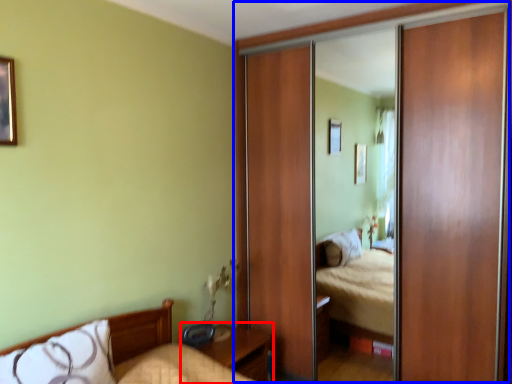
Question: Which object is closer to the camera taking this photo, nightstand (highlighted by a red box) or glass door (highlighted by a blue box)?

Choices:
 (A) nightstand
 (B) glass door

Answer: (B)